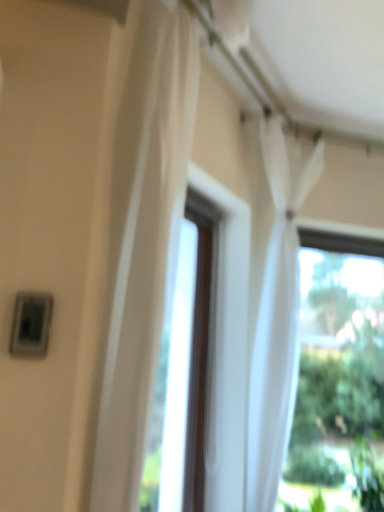
This screenshot has width=384, height=512. Describe the element at coordinates (144, 239) in the screenshot. I see `white sheer curtain at center, the 2th curtain positioned from the back` at that location.

Image resolution: width=384 pixels, height=512 pixels. Identify the location of white sheer curtain at center, which is the second curtain in right-to-left order. (144, 239).

Describe the element at coordinates (274, 297) in the screenshot. The image size is (384, 512). I see `white sheer curtain at upper center, the second curtain when ordered from front to back` at that location.

Measure the distance between white sheer curtain at upper center, the second curtain when ordered from front to back, and camera.

The distance of white sheer curtain at upper center, the second curtain when ordered from front to back, from camera is 6.15 feet.

Where is `white sheer curtain at upper center, which is the first curtain in right-to-left order`? The height and width of the screenshot is (512, 384). white sheer curtain at upper center, which is the first curtain in right-to-left order is located at coordinates (274, 297).

Locate an element on the screen. white sheer curtain at center, the 1th curtain positioned from the front is located at coordinates (144, 239).

Does white sheer curtain at upper center, which is the 1th curtain in back-to-front order, appear on the left side of white sheer curtain at center, which appears as the first curtain when viewed from the left?

No.

Looking at this image, who is more distant, white sheer curtain at upper center, which is the 1th curtain in back-to-front order, or white sheer curtain at center, which appears as the first curtain when viewed from the left?

white sheer curtain at upper center, which is the 1th curtain in back-to-front order, is further from the camera.

Which is behind, point (278, 199) or point (186, 139)?

The point (278, 199) is behind.

From the image's perspective, is white sheer curtain at upper center, the second curtain when ordered from front to back, above white sheer curtain at center, the 2th curtain positioned from the back?

No, from the image's perspective, white sheer curtain at upper center, the second curtain when ordered from front to back, is not on top of white sheer curtain at center, the 2th curtain positioned from the back.

From a real-world perspective, which object stands above the other?

white sheer curtain at center, which is the second curtain in right-to-left order, is physically above.

Can you confirm if white sheer curtain at upper center, which is the first curtain in right-to-left order, is wider than white sheer curtain at center, which appears as the first curtain when viewed from the left?

No, white sheer curtain at upper center, which is the first curtain in right-to-left order, is not wider than white sheer curtain at center, which appears as the first curtain when viewed from the left.

Who is shorter, white sheer curtain at upper center, the 2th curtain from the left, or white sheer curtain at center, the 2th curtain positioned from the back?

With less height is white sheer curtain at center, the 2th curtain positioned from the back.

Who is bigger, white sheer curtain at upper center, which is the 1th curtain in back-to-front order, or white sheer curtain at center, the 2th curtain positioned from the back?

white sheer curtain at center, the 2th curtain positioned from the back, is bigger.

Is white sheer curtain at center, which is the second curtain in right-to-left order, completely or partially inside white sheer curtain at upper center, the 2th curtain from the left?

No, white sheer curtain at center, which is the second curtain in right-to-left order, is not surrounded by white sheer curtain at upper center, the 2th curtain from the left.

Is white sheer curtain at upper center, which is the 1th curtain in back-to-front order, touching white sheer curtain at center, the 2th curtain positioned from the back?

No, white sheer curtain at upper center, which is the 1th curtain in back-to-front order, is not touching white sheer curtain at center, the 2th curtain positioned from the back.

Could you tell me if white sheer curtain at upper center, which is the 1th curtain in back-to-front order, is turned towards white sheer curtain at center, which is the second curtain in right-to-left order?

No, white sheer curtain at upper center, which is the 1th curtain in back-to-front order, is not turned towards white sheer curtain at center, which is the second curtain in right-to-left order.

What's the angular difference between white sheer curtain at upper center, the 2th curtain from the left, and white sheer curtain at center, the 2th curtain positioned from the back,'s facing directions?

The angular difference between white sheer curtain at upper center, the 2th curtain from the left, and white sheer curtain at center, the 2th curtain positioned from the back, is 20.8 degrees.

Locate an element on the screen. The image size is (384, 512). curtain that is above the white sheer curtain at upper center, the 2th curtain from the left (from the image's perspective) is located at coordinates (144, 239).

Consider the image. Considering the positions of objects white sheer curtain at center, which appears as the first curtain when viewed from the left, and white sheer curtain at upper center, the second curtain when ordered from front to back, in the image provided, who is more to the right, white sheer curtain at center, which appears as the first curtain when viewed from the left, or white sheer curtain at upper center, the second curtain when ordered from front to back,?

From the viewer's perspective, white sheer curtain at upper center, the second curtain when ordered from front to back, appears more on the right side.

Considering the positions of objects white sheer curtain at center, the 1th curtain positioned from the front, and white sheer curtain at upper center, the second curtain when ordered from front to back, in the image provided, who is behind, white sheer curtain at center, the 1th curtain positioned from the front, or white sheer curtain at upper center, the second curtain when ordered from front to back,?

white sheer curtain at upper center, the second curtain when ordered from front to back, is behind.

Considering the positions of point (166, 104) and point (254, 461), is point (166, 104) closer or farther from the camera than point (254, 461)?

Point (166, 104) appears to be closer to the viewer than point (254, 461).

From the image's perspective, is white sheer curtain at center, which appears as the first curtain when viewed from the left, below white sheer curtain at upper center, which is the 1th curtain in back-to-front order?

No.

From a real-world perspective, is white sheer curtain at center, which appears as the first curtain when viewed from the left, physically above white sheer curtain at upper center, which is the first curtain in right-to-left order?

Indeed, from a real-world perspective, white sheer curtain at center, which appears as the first curtain when viewed from the left, stands above white sheer curtain at upper center, which is the first curtain in right-to-left order.

Considering the sizes of objects white sheer curtain at center, the 2th curtain positioned from the back, and white sheer curtain at upper center, which is the first curtain in right-to-left order, in the image provided, who is wider, white sheer curtain at center, the 2th curtain positioned from the back, or white sheer curtain at upper center, which is the first curtain in right-to-left order,?

white sheer curtain at center, the 2th curtain positioned from the back, is wider.

Can you confirm if white sheer curtain at center, the 1th curtain positioned from the front, is shorter than white sheer curtain at upper center, which is the first curtain in right-to-left order?

Indeed, white sheer curtain at center, the 1th curtain positioned from the front, has a lesser height compared to white sheer curtain at upper center, which is the first curtain in right-to-left order.

Considering the relative sizes of white sheer curtain at center, which appears as the first curtain when viewed from the left, and white sheer curtain at upper center, which is the first curtain in right-to-left order, in the image provided, is white sheer curtain at center, which appears as the first curtain when viewed from the left, bigger than white sheer curtain at upper center, which is the first curtain in right-to-left order,?

Indeed, white sheer curtain at center, which appears as the first curtain when viewed from the left, has a larger size compared to white sheer curtain at upper center, which is the first curtain in right-to-left order.

From the picture: Can we say white sheer curtain at center, the 1th curtain positioned from the front, lies outside white sheer curtain at upper center, the second curtain when ordered from front to back?

Indeed, white sheer curtain at center, the 1th curtain positioned from the front, is completely outside white sheer curtain at upper center, the second curtain when ordered from front to back.

Is white sheer curtain at center, the 1th curtain positioned from the front, positioned far away from white sheer curtain at upper center, the 2th curtain from the left?

Actually, white sheer curtain at center, the 1th curtain positioned from the front, and white sheer curtain at upper center, the 2th curtain from the left, are a little close together.

Is white sheer curtain at center, which is the second curtain in right-to-left order, facing towards white sheer curtain at upper center, the second curtain when ordered from front to back?

No, white sheer curtain at center, which is the second curtain in right-to-left order, does not turn towards white sheer curtain at upper center, the second curtain when ordered from front to back.

This screenshot has width=384, height=512. What are the coordinates of `curtain behind the white sheer curtain at center, which appears as the first curtain when viewed from the left` in the screenshot? It's located at (274, 297).

Find the location of a particular element. The height and width of the screenshot is (512, 384). curtain above the white sheer curtain at upper center, which is the 1th curtain in back-to-front order (from a real-world perspective) is located at coordinates (144, 239).

Image resolution: width=384 pixels, height=512 pixels. In order to click on curtain in front of the white sheer curtain at upper center, the second curtain when ordered from front to back in this screenshot , I will do `click(144, 239)`.